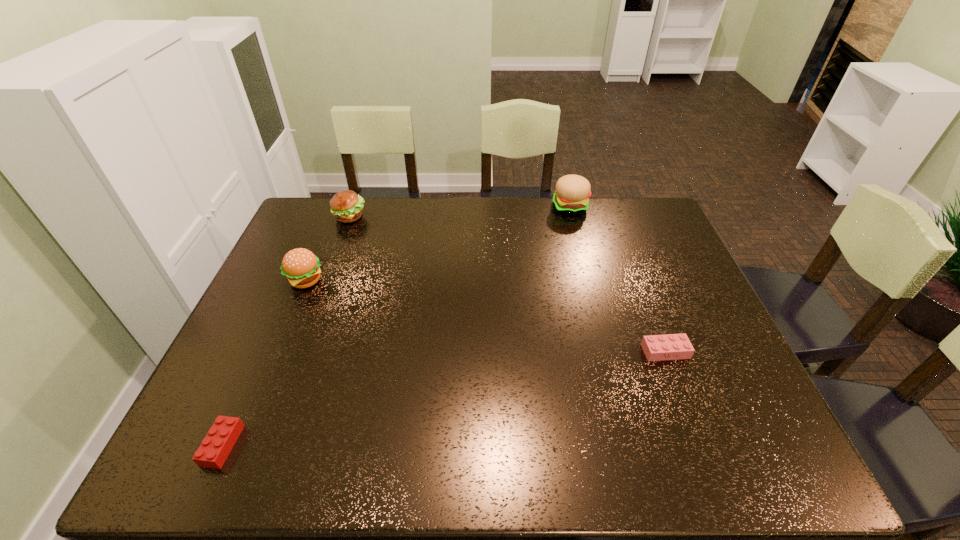
Find the location of `object that is at the near edge`. object that is at the near edge is located at coordinates (212, 453).

Where is `Lego situated at the left edge`? This screenshot has width=960, height=540. Lego situated at the left edge is located at coordinates (212, 453).

Image resolution: width=960 pixels, height=540 pixels. In order to click on object present at the right edge in this screenshot , I will do `click(671, 346)`.

At what (x,y) coordinates should I click in order to perform the action: click on object that is at the far left corner. Please return your answer as a coordinate pair (x, y). The height and width of the screenshot is (540, 960). Looking at the image, I should click on (346, 206).

Locate an element on the screen. The image size is (960, 540). object located in the near left corner section of the desktop is located at coordinates (212, 453).

I want to click on vacant space at the far edge of the desktop, so click(367, 211).

I want to click on vacant point at the left edge, so click(x=284, y=366).

This screenshot has height=540, width=960. In the image, there is a desktop. Find the location of `free space at the right edge`. free space at the right edge is located at coordinates (642, 248).

Find the location of a particular element. vacant space at the far right corner of the desktop is located at coordinates (660, 214).

Where is `free space between the rightmost object and the third farthest object`? This screenshot has width=960, height=540. free space between the rightmost object and the third farthest object is located at coordinates (485, 316).